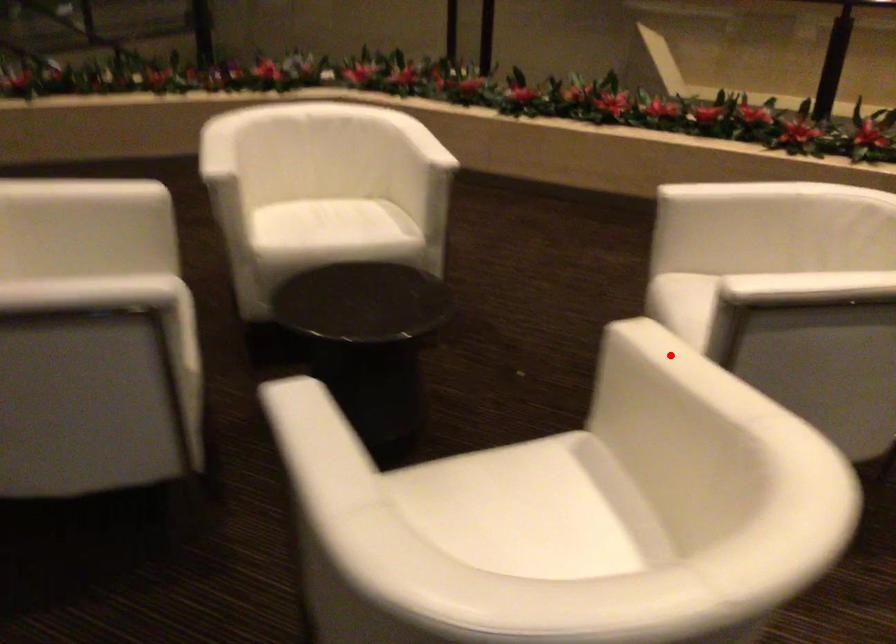
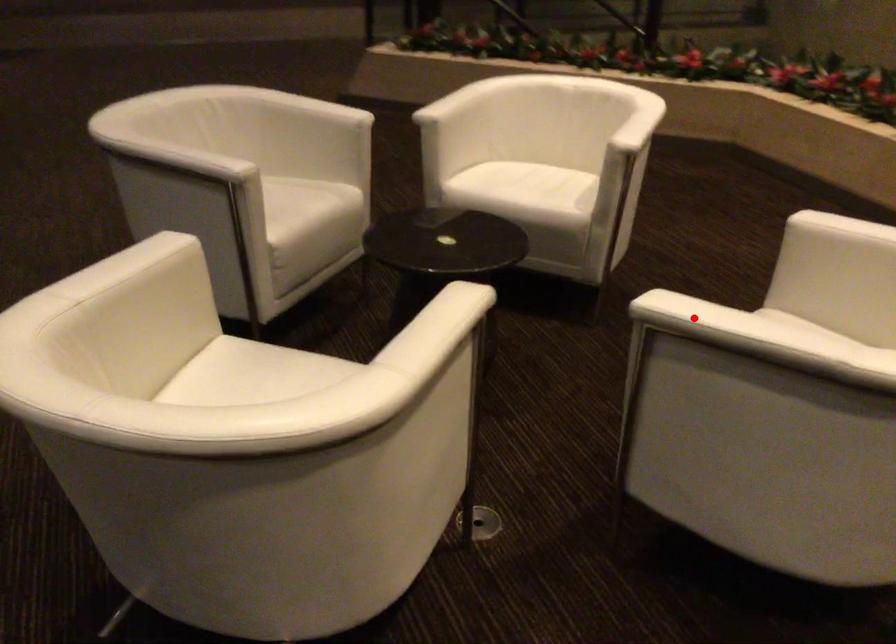
I am providing you with two images of the same scene from different viewpoints. A red point is marked on the first image and another point is marked on the second image. Is the red point in image1 aligned with the point shown in image2?

No